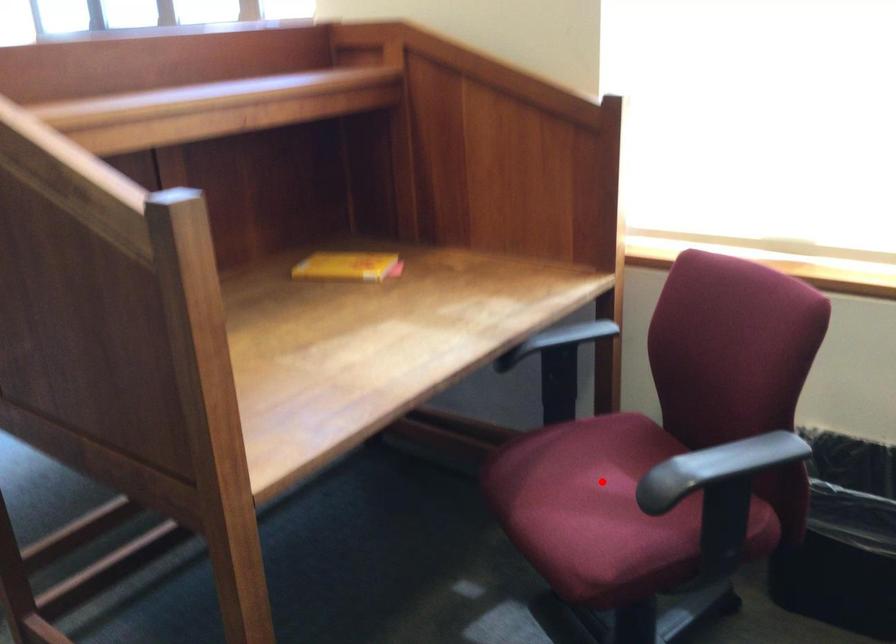
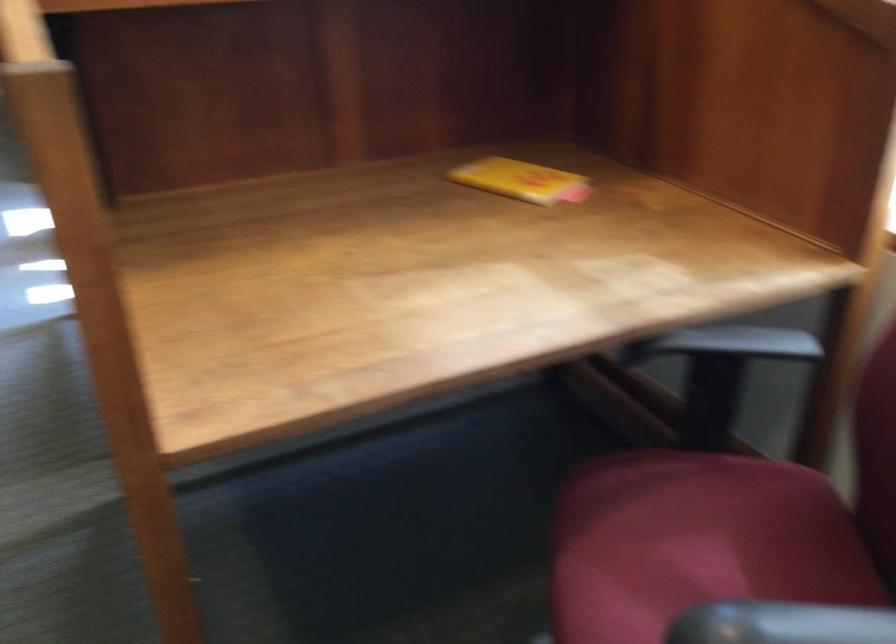
The point at the highlighted location is marked in the first image. Where is the corresponding point in the second image?

(694, 554)